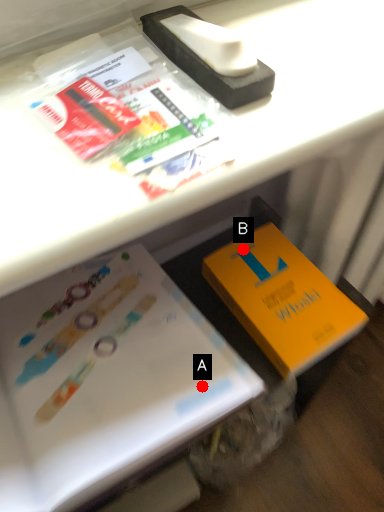
Question: Two points are circled on the image, labeled by A and B beside each circle. Among these points, which one is nearest to the camera?

Choices:
 (A) A is closer
 (B) B is closer

Answer: (A)